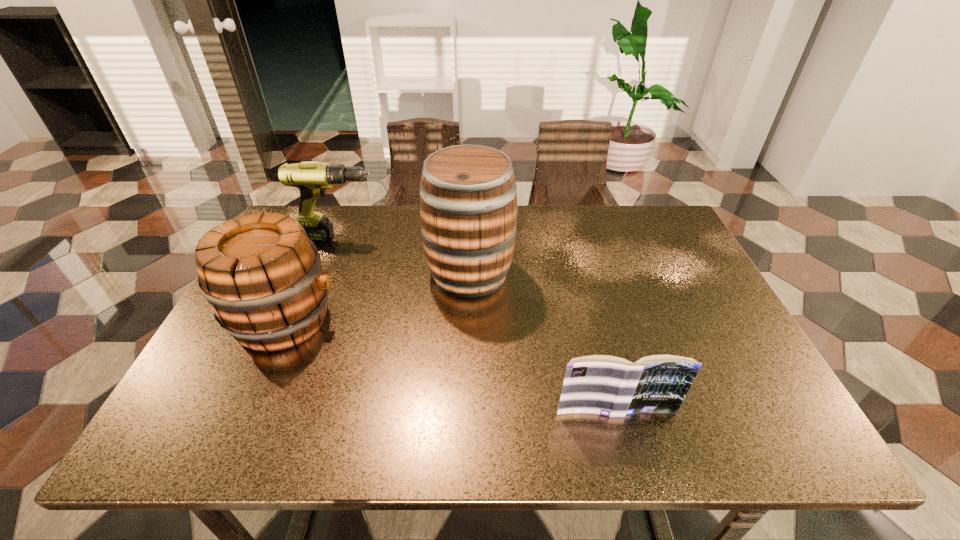
Where is `drill situated at the far edge`? The height and width of the screenshot is (540, 960). drill situated at the far edge is located at coordinates (312, 178).

Identify the location of object located at the near edge. The width and height of the screenshot is (960, 540). (606, 385).

At what (x,y) coordinates should I click in order to perform the action: click on drill situated at the left edge. Please return your answer as a coordinate pair (x, y). Looking at the image, I should click on coord(312,178).

Locate an element on the screen. This screenshot has height=540, width=960. cider that is at the left edge is located at coordinates (262, 276).

Identify the location of object that is positioned at the far left corner. The width and height of the screenshot is (960, 540). (312, 178).

Locate an element on the screen. free space at the far edge is located at coordinates (586, 212).

At what (x,y) coordinates should I click in order to perform the action: click on free location at the near edge. Please return your answer as a coordinate pair (x, y). This screenshot has width=960, height=540. Looking at the image, I should click on (409, 408).

Identify the location of vacant space at the left edge of the desktop. This screenshot has height=540, width=960. (226, 404).

In the image, there is a desktop. At what (x,y) coordinates should I click in order to perform the action: click on free region at the right edge. Please return your answer as a coordinate pair (x, y). Looking at the image, I should click on (684, 319).

Find the location of a particular element. The image size is (960, 540). vacant space at the near right corner of the desktop is located at coordinates pyautogui.click(x=757, y=445).